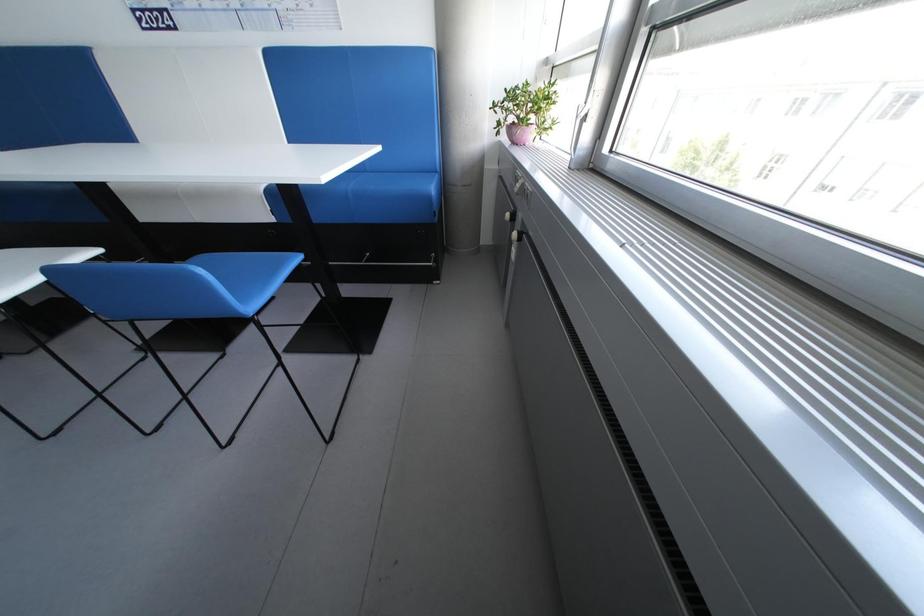
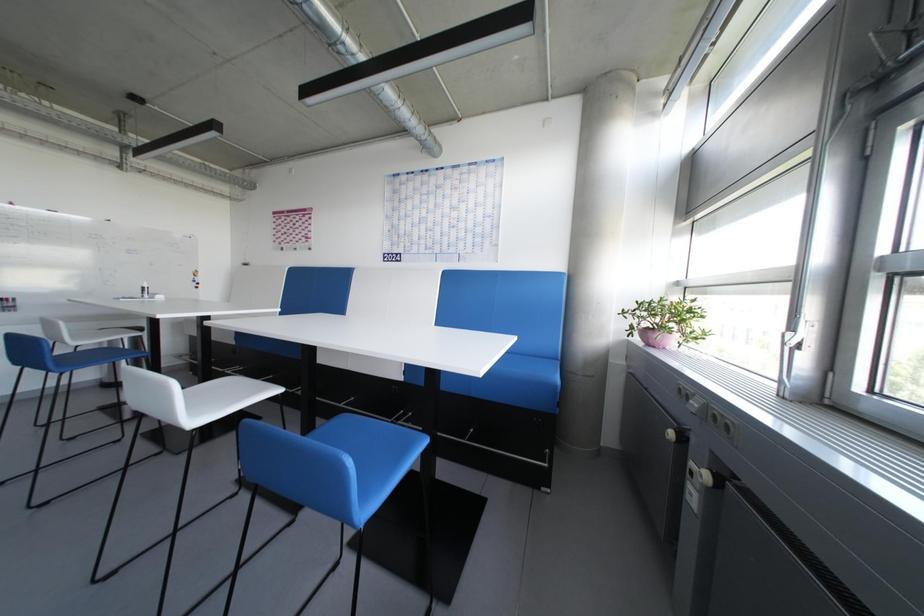
The first image is from the beginning of the video and the second image is from the end. How did the camera likely rotate when shooting the video?

The camera rotated toward left-up.